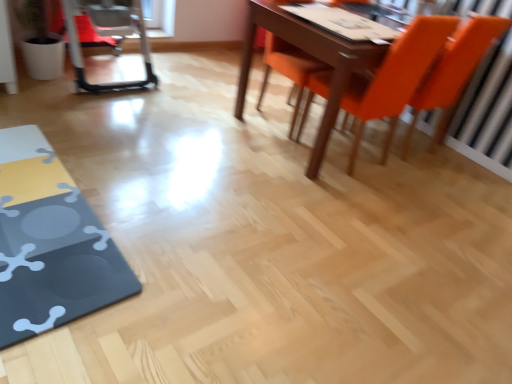
Locate an element on the screen. vacant space situated on the left part of orange matte chair at upper right, which appears as the third chair when viewed from the right is located at coordinates (215, 99).